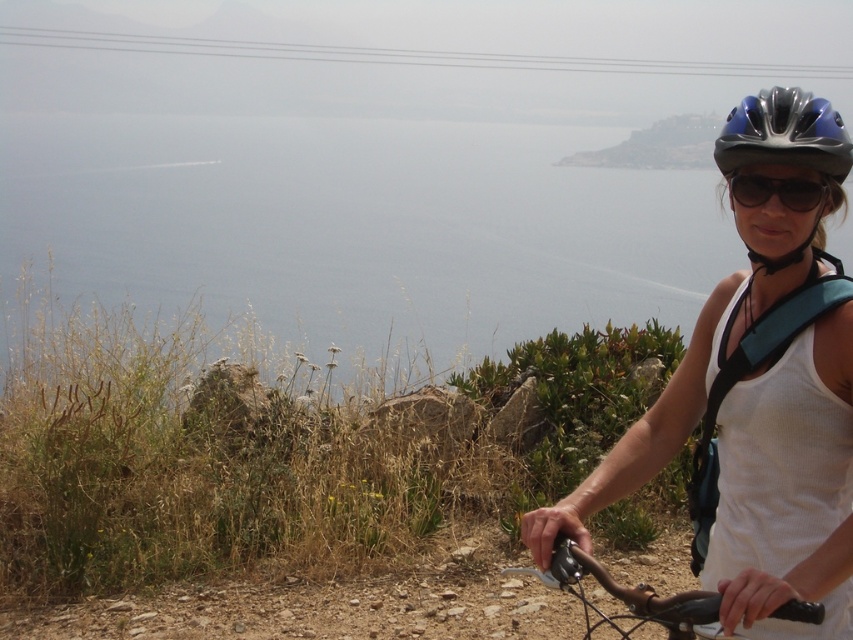
Question: Can you confirm if white fabric tank top at right is thinner than blue matte bicycle helmet at upper right?

Choices:
 (A) yes
 (B) no

Answer: (B)

Question: Is blue matte bicycle helmet at upper right wider than black matte sunglasses at upper right?

Choices:
 (A) yes
 (B) no

Answer: (A)

Question: Is white fabric tank top at right closer to the viewer compared to blue matte bicycle helmet at upper right?

Choices:
 (A) yes
 (B) no

Answer: (A)

Question: Which of the following is the closest to the observer?

Choices:
 (A) click(x=729, y=163)
 (B) click(x=691, y=634)
 (C) click(x=770, y=179)

Answer: (B)

Question: Which of the following is the closest to the observer?

Choices:
 (A) (605, 576)
 (B) (738, 163)

Answer: (A)

Question: Among these points, which one is nearest to the camera?

Choices:
 (A) (709, 340)
 (B) (782, 106)
 (C) (587, 573)
 (D) (799, 205)

Answer: (C)